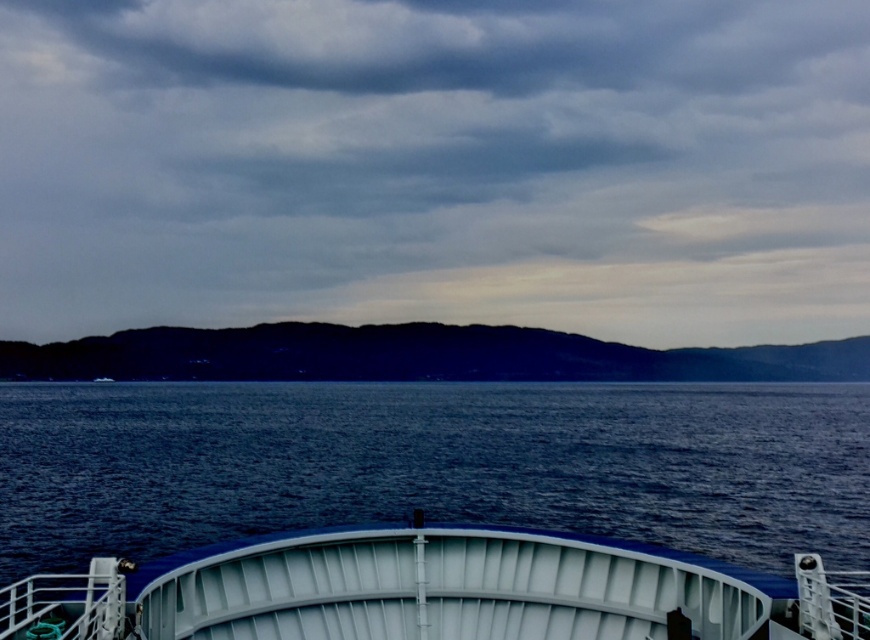
You are standing on the ship deck and want to take a photo of the blue water at center. Where should you aim your camera to capture it?

To capture the blue water at center, aim your camera at the coordinates point (432, 465).

You are a sailor on the ship deck and want to know which object in the scene occupies a larger area in the image. Based on the gray matte cloud at upper center and the dark blue water at center, which one takes up more space?

The gray matte cloud at upper center is bigger than the dark blue water at center, so it occupies a larger area in the image.